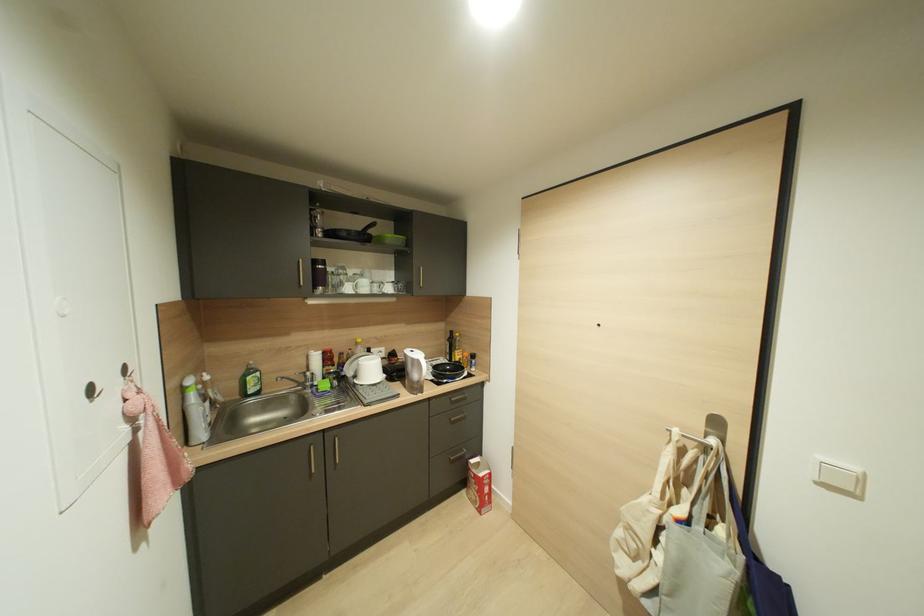
The height and width of the screenshot is (616, 924). Describe the element at coordinates (837, 476) in the screenshot. I see `the white light switch` at that location.